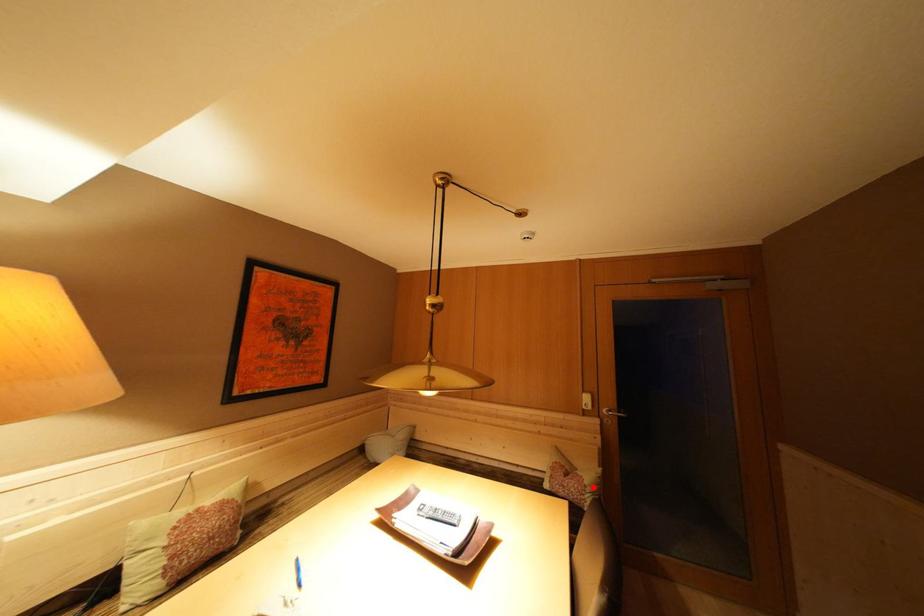
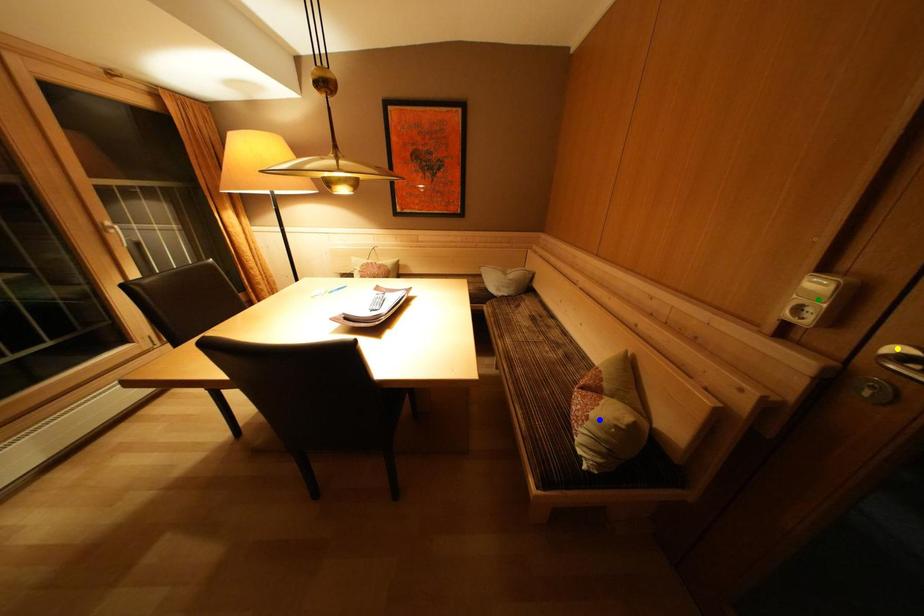
Question: I am providing you with two images of the same scene from different viewpoints. A red point is marked on the first image. You are given multiple points on the second image. Can you choose the point in image 2 that corresponds to the point in image 1?

Choices:
 (A) green point
 (B) blue point
 (C) yellow point

Answer: (B)